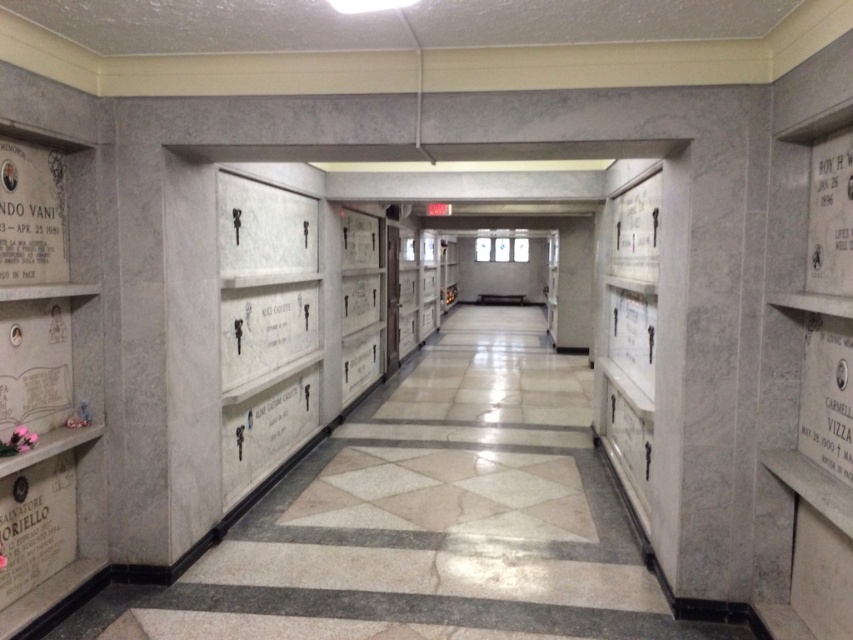
Is white marble crypts at left closer to the viewer compared to black marble plaque at left?

No, white marble crypts at left is further to the viewer.

The height and width of the screenshot is (640, 853). Find the location of `white marble crypts at left`. white marble crypts at left is located at coordinates (430, 518).